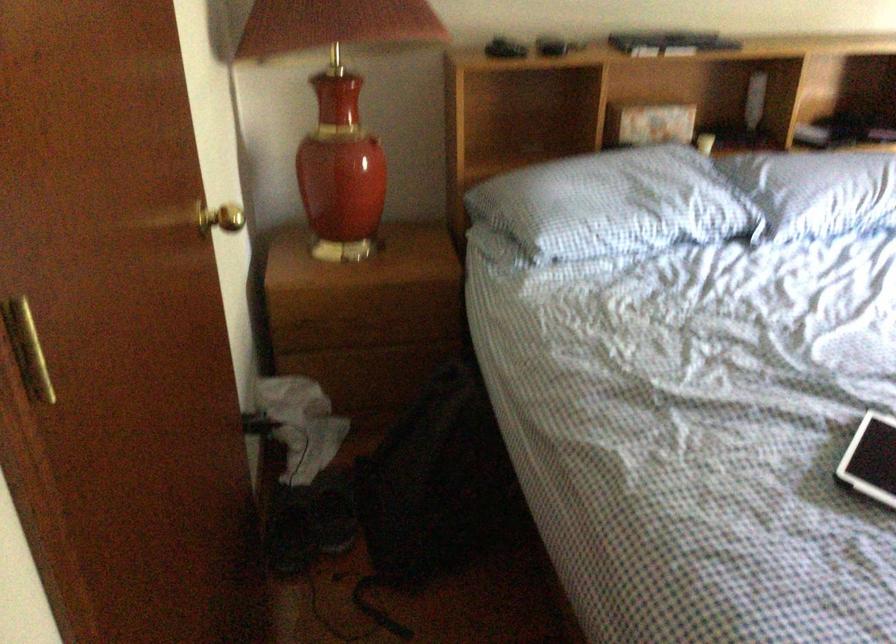
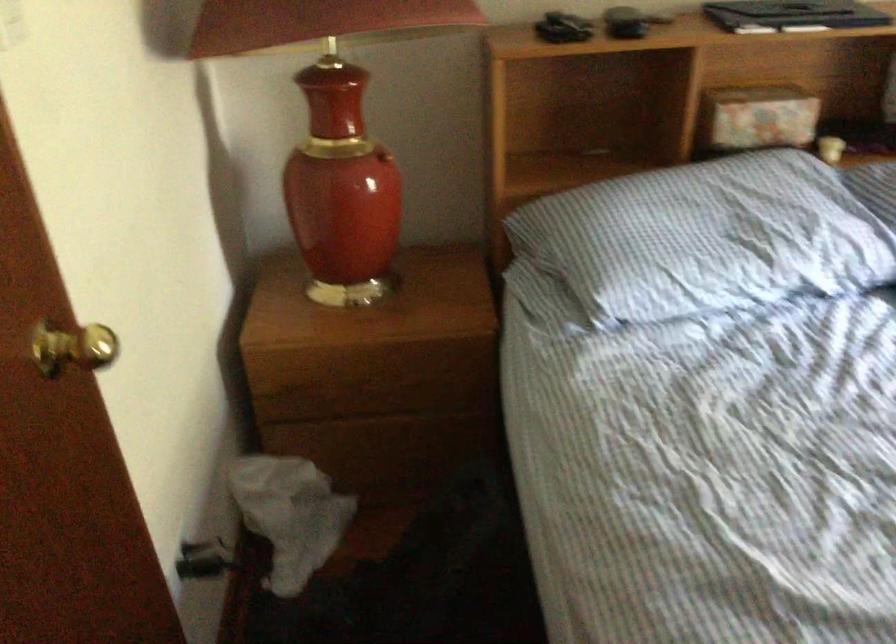
Locate, in the second image, the point that corresponds to the point at 653,120 in the first image.

(757, 118)